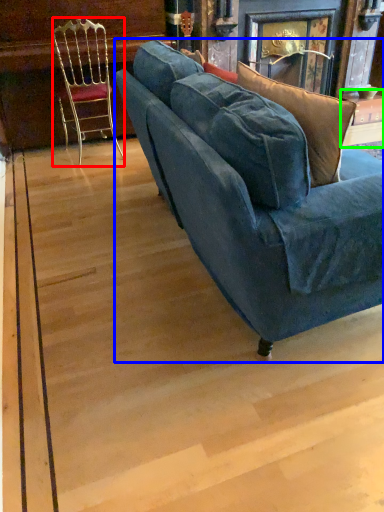
Question: Which object is positioned farthest from chair (highlighted by a red box)? Select from studio couch (highlighted by a blue box) and table (highlighted by a green box).

Choices:
 (A) studio couch
 (B) table

Answer: (B)